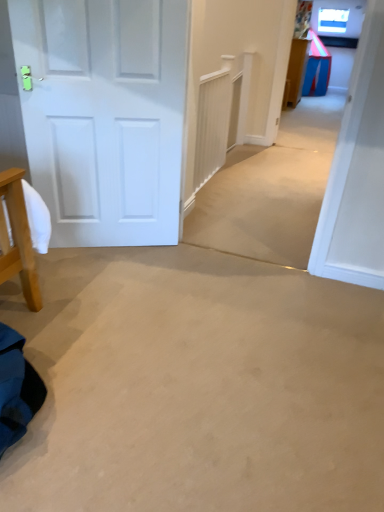
Question: From a real-world perspective, relative to blue plastic table at upper right, is white matte door at left vertically above or below?

Choices:
 (A) above
 (B) below

Answer: (A)

Question: Based on their positions, is white matte door at left located to the left or right of blue plastic table at upper right?

Choices:
 (A) right
 (B) left

Answer: (B)

Question: From their relative heights in the image, would you say white matte door at left is taller or shorter than blue plastic table at upper right?

Choices:
 (A) short
 (B) tall

Answer: (B)

Question: From the image's perspective, relative to white matte door at left, is blue plastic table at upper right above or below?

Choices:
 (A) below
 (B) above

Answer: (B)

Question: Is point (291, 74) closer or farther from the camera than point (110, 54)?

Choices:
 (A) closer
 (B) farther

Answer: (B)

Question: Is blue plastic table at upper right taller or shorter than white matte door at left?

Choices:
 (A) short
 (B) tall

Answer: (A)

Question: In the image, is blue plastic table at upper right positioned in front of or behind white matte door at left?

Choices:
 (A) behind
 (B) front

Answer: (A)